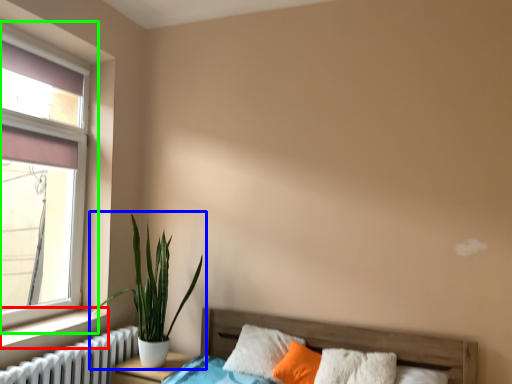
Question: Based on their relative distances, which object is nearer to window sill (highlighted by a red box)? Choose from houseplant (highlighted by a blue box) and window (highlighted by a green box).

Choices:
 (A) houseplant
 (B) window

Answer: (A)